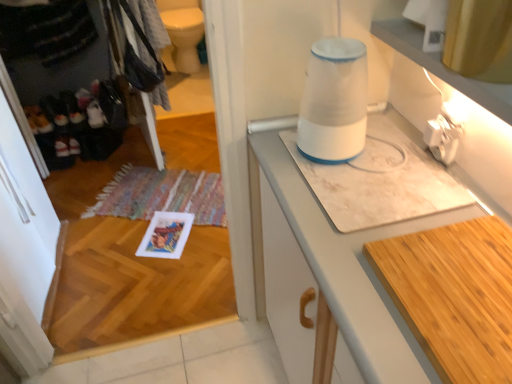
Locate an element on the screen. Image resolution: width=512 pixels, height=384 pixels. vacant space positioned to the left of white plastic blender at upper center is located at coordinates (276, 154).